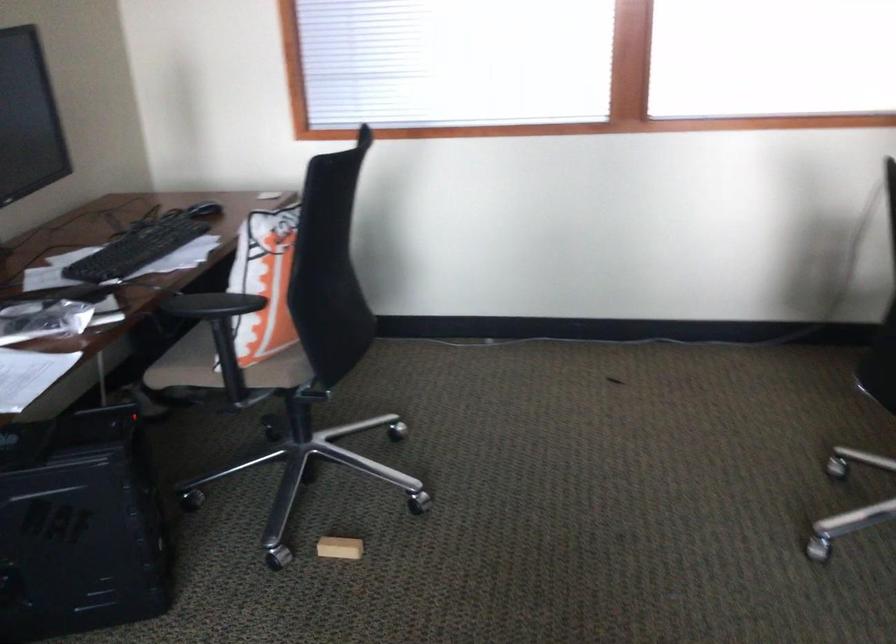
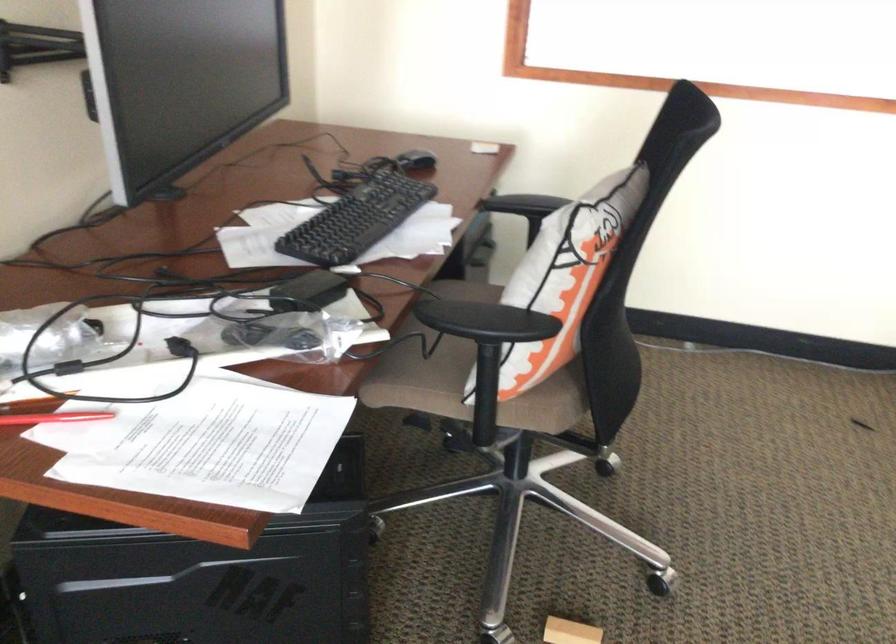
The images are taken continuously from a first-person perspective. In which direction are you moving?

The movement direction of the cameraman is left, forward.